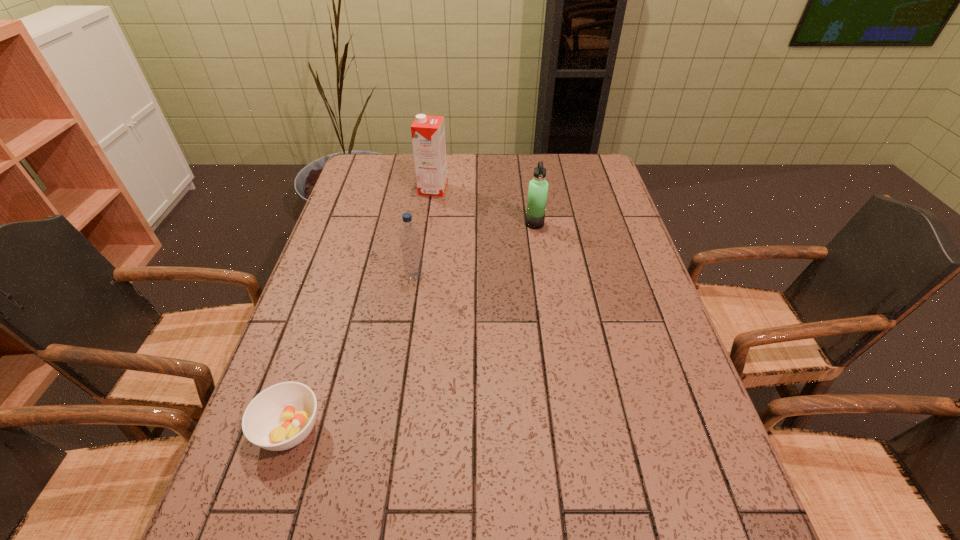
Where is `free space located 0.280m on the back of the leftmost object`? The image size is (960, 540). free space located 0.280m on the back of the leftmost object is located at coordinates (332, 302).

Locate an element on the screen. object located in the far edge section of the desktop is located at coordinates (428, 132).

Find the location of `object located at the left edge`. object located at the left edge is located at coordinates (280, 417).

I want to click on blank space at the far edge, so pos(547,154).

The height and width of the screenshot is (540, 960). In the image, there is a desktop. Identify the location of free region at the left edge. (352, 291).

The height and width of the screenshot is (540, 960). Find the location of `vacant space at the far left corner`. vacant space at the far left corner is located at coordinates (350, 180).

The height and width of the screenshot is (540, 960). In order to click on free space between the second farthest object and the farthest object in this screenshot , I will do `click(484, 206)`.

Locate an element on the screen. The width and height of the screenshot is (960, 540). vacant space in between the third nearest object and the water bottle is located at coordinates (475, 249).

Identify the location of unoccupied position between the rightmost object and the tallest object. The image size is (960, 540). (484, 206).

This screenshot has height=540, width=960. What are the coordinates of `vacant area that lies between the water bottle and the thermos bottle` in the screenshot? It's located at (475, 249).